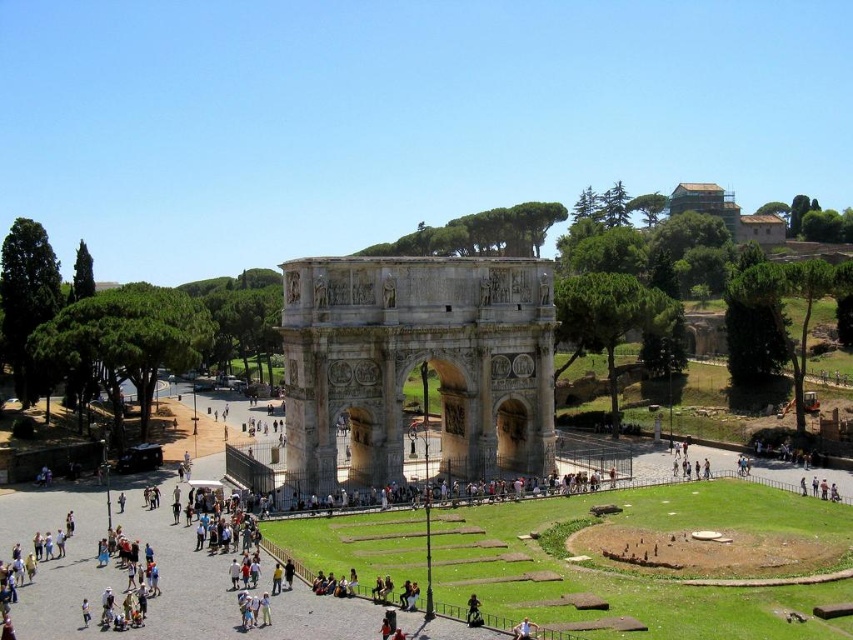
Question: Does beige stone arch at center appear over brown wooden house at upper right?

Choices:
 (A) no
 (B) yes

Answer: (A)

Question: Can you confirm if beige stone arch at center is positioned to the right of brown wooden house at upper right?

Choices:
 (A) no
 (B) yes

Answer: (A)

Question: Can you confirm if beige stone arch at center is positioned to the right of brown wooden house at upper right?

Choices:
 (A) no
 (B) yes

Answer: (A)

Question: Which point is farther to the camera?

Choices:
 (A) click(x=701, y=186)
 (B) click(x=347, y=273)

Answer: (A)

Question: Which point is closer to the camera taking this photo?

Choices:
 (A) (328, 394)
 (B) (741, 236)

Answer: (A)

Question: Which object appears closest to the camera in this image?

Choices:
 (A) beige stone arch at center
 (B) brown wooden house at upper right

Answer: (A)